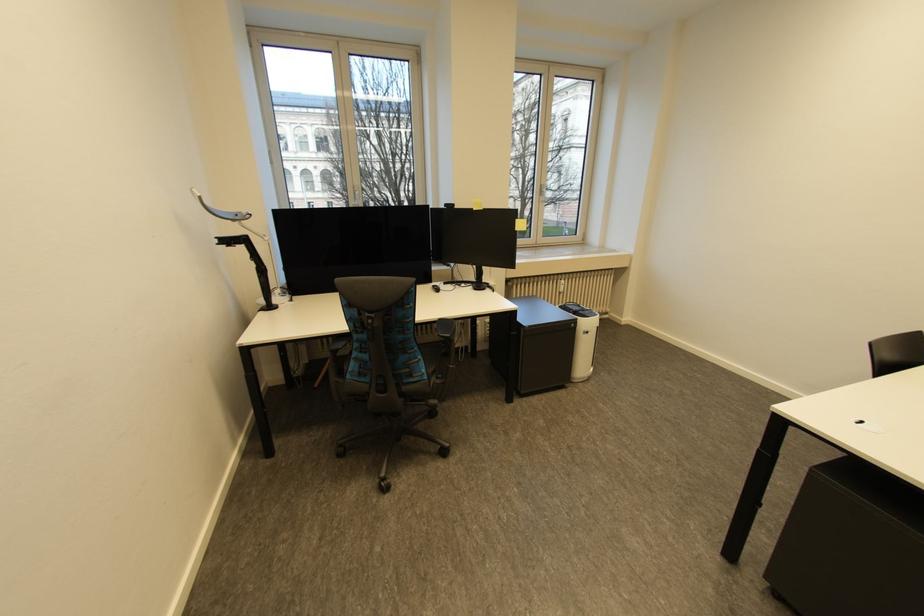
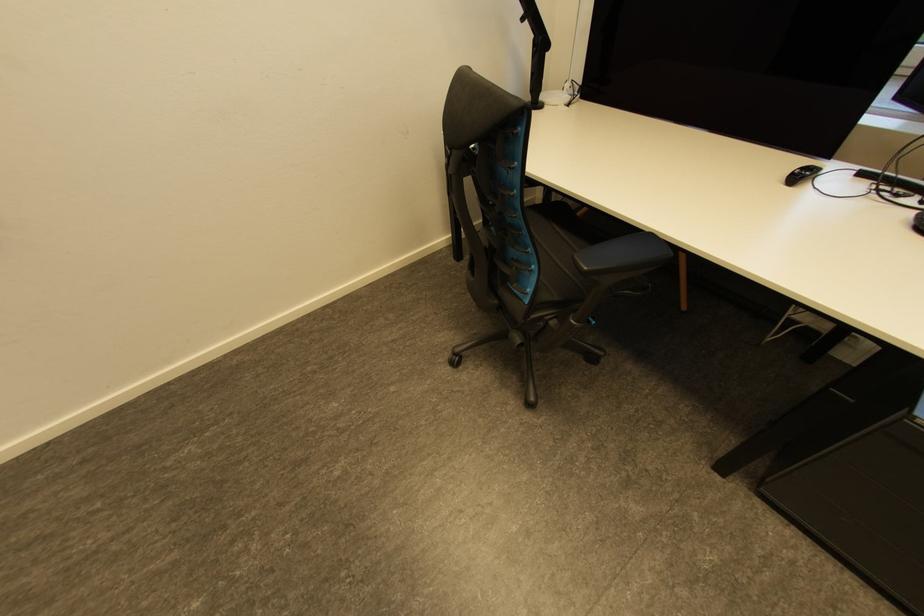
The point at (456, 336) is marked in the first image. Where is the corresponding point in the second image?

(591, 269)